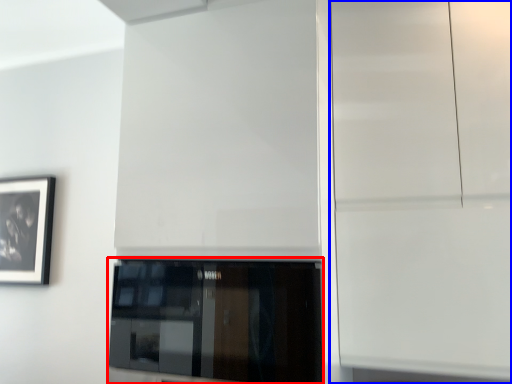
Question: Which object appears farthest to the camera in this image, window (highlighted by a red box) or glass door (highlighted by a blue box)?

Choices:
 (A) window
 (B) glass door

Answer: (B)